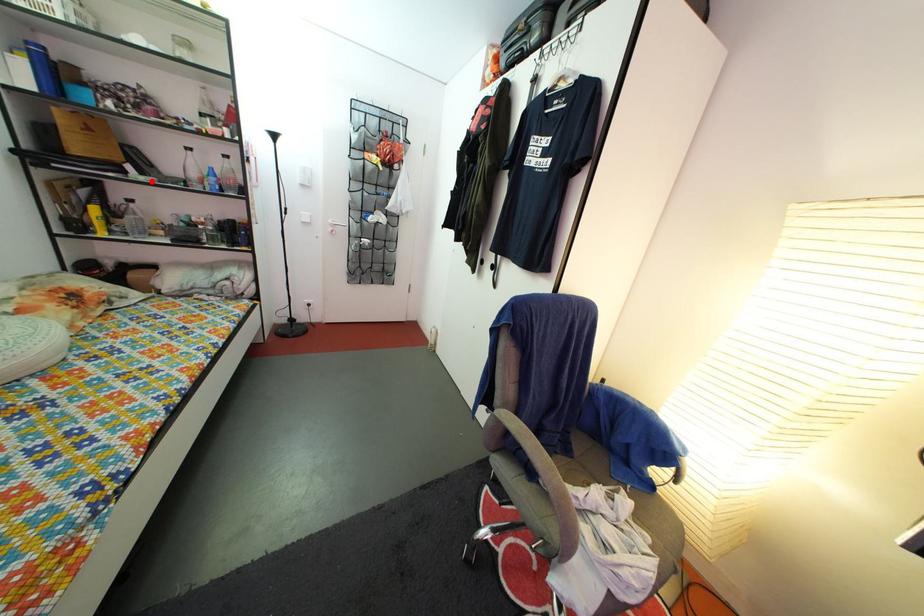
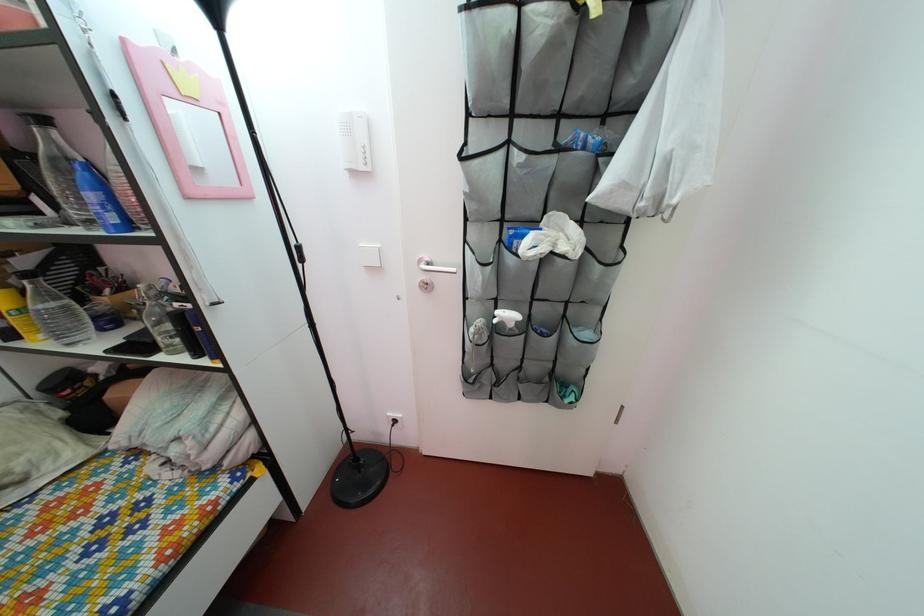
Locate, in the second image, the point that corresponds to the highlighted location in the first image.

(68, 217)